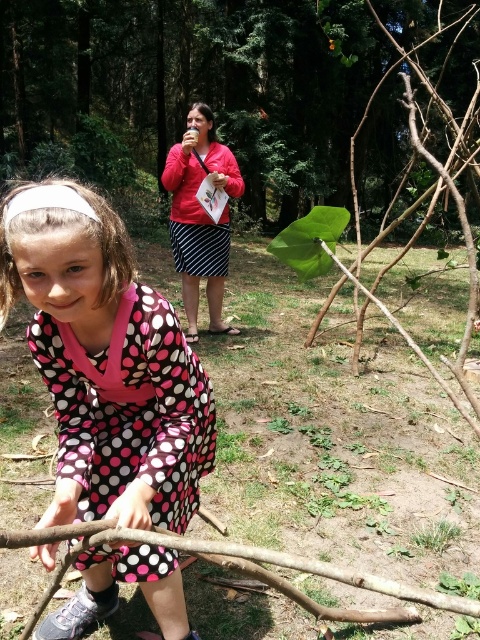
In the forest scene, you see a green leafy plant at upper center and a brown rough tree branch at center right. Which object is located to the left of the other?

The green leafy plant at upper center is positioned on the left side of brown rough tree branch at center right.

The young girl is wearing a pink polka dot dress at lower left and holding a brown rough tree branch at lower center. Which object takes up more space in the image?

The brown rough tree branch at lower center takes up more space in the image than the pink polka dot dress at lower left because the pink polka dot dress at lower left occupies less space than brown rough tree branch at lower center.